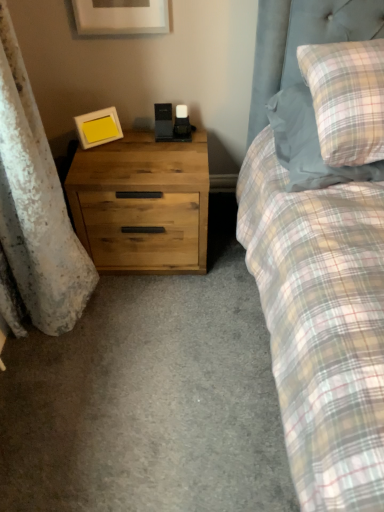
Question: Are matte yellow picture frame at left, which is the 1th picture frame in bottom-to-top order, and matte white picture frame at upper center, positioned as the second picture frame in back-to-front order, located far from each other?

Choices:
 (A) yes
 (B) no

Answer: (B)

Question: Is matte yellow picture frame at left, which is the 1th picture frame in bottom-to-top order, smaller than matte white picture frame at upper center, the 2th picture frame positioned from the bottom?

Choices:
 (A) no
 (B) yes

Answer: (B)

Question: Does matte yellow picture frame at left, the second picture frame viewed from the top, have a lesser height compared to matte white picture frame at upper center, positioned as the second picture frame in back-to-front order?

Choices:
 (A) yes
 (B) no

Answer: (A)

Question: Considering the relative sizes of matte yellow picture frame at left, which is the 1th picture frame in bottom-to-top order, and matte white picture frame at upper center, the first picture frame positioned from the front, in the image provided, is matte yellow picture frame at left, which is the 1th picture frame in bottom-to-top order, wider than matte white picture frame at upper center, the first picture frame positioned from the front,?

Choices:
 (A) no
 (B) yes

Answer: (B)

Question: Is matte yellow picture frame at left, which appears as the 1th picture frame when viewed from the back, beside matte white picture frame at upper center, the 1th picture frame positioned from the top?

Choices:
 (A) yes
 (B) no

Answer: (B)

Question: Looking at their shapes, would you say matte white picture frame at upper center, the first picture frame positioned from the front, is wider or thinner than matte yellow picture frame at left, which is the 1th picture frame in bottom-to-top order?

Choices:
 (A) wide
 (B) thin

Answer: (B)

Question: Is matte white picture frame at upper center, positioned as the second picture frame in back-to-front order, inside the boundaries of matte yellow picture frame at left, the second picture frame viewed from the top, or outside?

Choices:
 (A) outside
 (B) inside

Answer: (A)

Question: Based on their positions, is matte white picture frame at upper center, positioned as the second picture frame in back-to-front order, located to the left or right of matte yellow picture frame at left, acting as the 2th picture frame starting from the front?

Choices:
 (A) right
 (B) left

Answer: (A)

Question: Considering the positions of matte white picture frame at upper center, the 2th picture frame positioned from the bottom, and matte yellow picture frame at left, which appears as the 1th picture frame when viewed from the back, in the image, is matte white picture frame at upper center, the 2th picture frame positioned from the bottom, taller or shorter than matte yellow picture frame at left, which appears as the 1th picture frame when viewed from the back,?

Choices:
 (A) short
 (B) tall

Answer: (B)

Question: From the image's perspective, is plaid fabric pillow at upper right located above or below matte white picture frame at upper center, the 2th picture frame positioned from the bottom?

Choices:
 (A) above
 (B) below

Answer: (B)

Question: Considering the positions of plaid fabric pillow at upper right and matte white picture frame at upper center, positioned as the second picture frame in back-to-front order, in the image, is plaid fabric pillow at upper right wider or thinner than matte white picture frame at upper center, positioned as the second picture frame in back-to-front order,?

Choices:
 (A) thin
 (B) wide

Answer: (B)

Question: Is plaid fabric pillow at upper right in front of or behind matte white picture frame at upper center, the 1th picture frame positioned from the top, in the image?

Choices:
 (A) behind
 (B) front

Answer: (B)

Question: Considering the positions of plaid fabric pillow at upper right and matte white picture frame at upper center, the 2th picture frame positioned from the bottom, in the image, is plaid fabric pillow at upper right bigger or smaller than matte white picture frame at upper center, the 2th picture frame positioned from the bottom,?

Choices:
 (A) small
 (B) big

Answer: (B)

Question: Is point (140, 156) closer or farther from the camera than point (84, 124)?

Choices:
 (A) closer
 (B) farther

Answer: (A)

Question: Based on their sizes in the image, would you say natural wood chest of drawers at left is bigger or smaller than matte yellow picture frame at left, the second picture frame viewed from the top?

Choices:
 (A) big
 (B) small

Answer: (A)